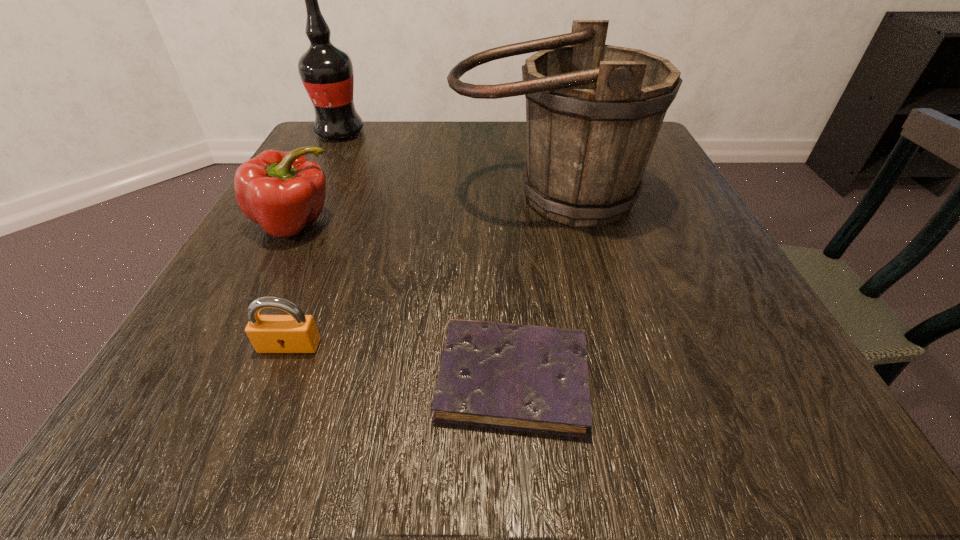
The height and width of the screenshot is (540, 960). Find the location of `vacant area between the fourth shortest object and the shortest object`. vacant area between the fourth shortest object and the shortest object is located at coordinates (530, 287).

Identify the location of vacant space in between the diary and the wine bottle. This screenshot has width=960, height=540. (426, 255).

Select which object is the closest to the bucket. Please provide its 2D coordinates. Your answer should be formatted as a tuple, i.e. [(x, y)], where the tuple contains the x and y coordinates of a point satisfying the conditions above.

[(282, 191)]

In order to click on the third closest object to the bucket in this screenshot , I will do `click(326, 71)`.

Where is `free space that satisfies the following two spatial constraints: 1. on the front side of the shortest object; 2. on the right side of the wine bottle`? This screenshot has width=960, height=540. free space that satisfies the following two spatial constraints: 1. on the front side of the shortest object; 2. on the right side of the wine bottle is located at coordinates pyautogui.click(x=212, y=378).

Identify the location of free space that satisfies the following two spatial constraints: 1. on the front side of the pepper; 2. on the right side of the farthest object. The width and height of the screenshot is (960, 540). (293, 224).